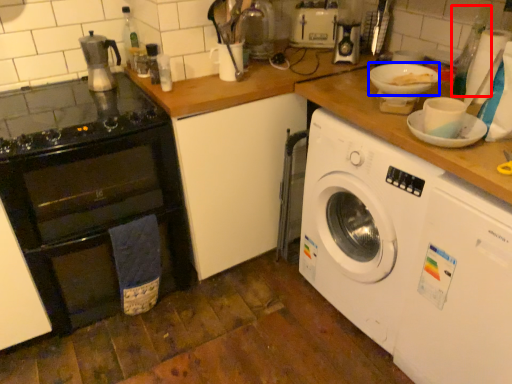
Question: Which object is further to the camera taking this photo, bottle (highlighted by a red box) or basin (highlighted by a blue box)?

Choices:
 (A) bottle
 (B) basin

Answer: (A)